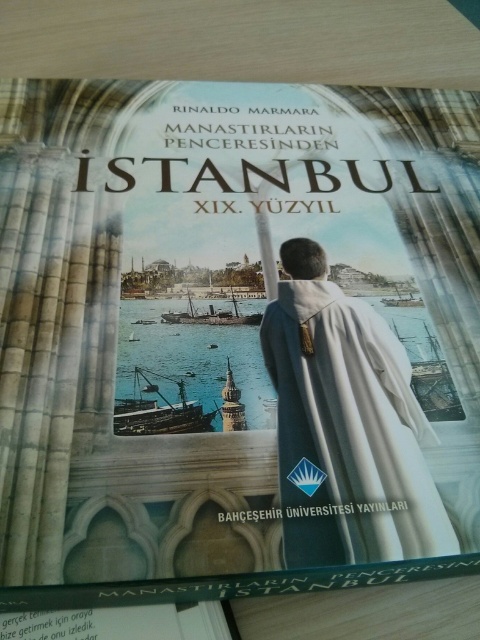
You are looking at the book cover and notice two points marked on it. The first point is at coordinate point (437, 518) and the second is at point (127, 417). Which of these points is nearer to you as you view the cover?

Point (437, 518) is closer to the camera than point (127, 417), so the first point is nearer to you as you view the cover.

You are looking at the book cover and notice two points marked on it. The first point is at coordinates point (308, 304) and the second at point (240, 316). Based on the scene, which point is closer to you?

Point (308, 304) is further to the camera than point (240, 316), so the point closer to you is point (240, 316).